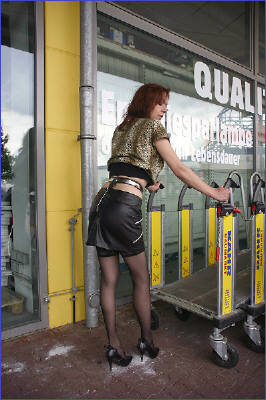
Locate an element on the screen. window is located at coordinates (21, 191).